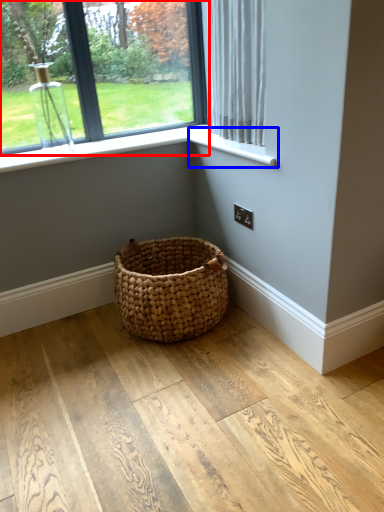
Question: Which object appears farthest to the camera in this image, window (highlighted by a red box) or window sill (highlighted by a blue box)?

Choices:
 (A) window
 (B) window sill

Answer: (A)